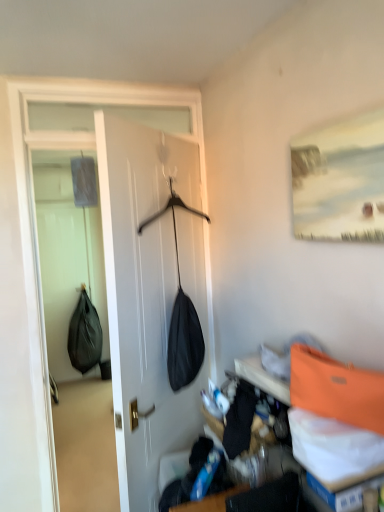
Question: Is black matte shoulder bag at left, arranged as the second shoulder bag when viewed from the right, taller than orange fabric shoulder bag at upper right, marked as the first shoulder bag in a right-to-left arrangement?

Choices:
 (A) yes
 (B) no

Answer: (A)

Question: From the image's perspective, is black matte shoulder bag at left, the 1th shoulder bag positioned from the back, located above orange fabric shoulder bag at upper right, the second shoulder bag when ordered from left to right?

Choices:
 (A) yes
 (B) no

Answer: (B)

Question: Is black matte shoulder bag at left, acting as the 1th shoulder bag starting from the bottom, not within orange fabric shoulder bag at upper right, placed as the first shoulder bag when sorted from front to back?

Choices:
 (A) yes
 (B) no

Answer: (A)

Question: Can you confirm if black matte shoulder bag at left, which ranks as the 1th shoulder bag in left-to-right order, is shorter than orange fabric shoulder bag at upper right, marked as the first shoulder bag in a right-to-left arrangement?

Choices:
 (A) no
 (B) yes

Answer: (A)

Question: Is black matte shoulder bag at left, acting as the 1th shoulder bag starting from the bottom, wider than orange fabric shoulder bag at upper right, the 1th shoulder bag from the top?

Choices:
 (A) no
 (B) yes

Answer: (B)

Question: Considering the relative sizes of black matte shoulder bag at left, the 1th shoulder bag positioned from the back, and orange fabric shoulder bag at upper right, marked as the first shoulder bag in a right-to-left arrangement, in the image provided, is black matte shoulder bag at left, the 1th shoulder bag positioned from the back, smaller than orange fabric shoulder bag at upper right, marked as the first shoulder bag in a right-to-left arrangement,?

Choices:
 (A) no
 (B) yes

Answer: (A)

Question: Considering the relative sizes of black matte shoulder bag at left, which is the second shoulder bag from top to bottom, and matte white painting at upper right in the image provided, is black matte shoulder bag at left, which is the second shoulder bag from top to bottom, thinner than matte white painting at upper right?

Choices:
 (A) no
 (B) yes

Answer: (A)

Question: Does black matte shoulder bag at left, the 1th shoulder bag positioned from the back, have a smaller size compared to matte white painting at upper right?

Choices:
 (A) no
 (B) yes

Answer: (A)

Question: From the image's perspective, is black matte shoulder bag at left, the 1th shoulder bag positioned from the back, beneath matte white painting at upper right?

Choices:
 (A) no
 (B) yes

Answer: (B)

Question: Considering the relative positions of black matte shoulder bag at left, acting as the 1th shoulder bag starting from the bottom, and matte white painting at upper right in the image provided, is black matte shoulder bag at left, acting as the 1th shoulder bag starting from the bottom, to the right of matte white painting at upper right from the viewer's perspective?

Choices:
 (A) no
 (B) yes

Answer: (A)

Question: From a real-world perspective, does black matte shoulder bag at left, which ranks as the 1th shoulder bag in left-to-right order, stand above matte white painting at upper right?

Choices:
 (A) no
 (B) yes

Answer: (A)

Question: Considering the relative positions of orange fabric shoulder bag at upper right, the 1th shoulder bag from the top, and black matte shoulder bag at left, the second shoulder bag when ordered from front to back, in the image provided, is orange fabric shoulder bag at upper right, the 1th shoulder bag from the top, to the right of black matte shoulder bag at left, the second shoulder bag when ordered from front to back, from the viewer's perspective?

Choices:
 (A) yes
 (B) no

Answer: (A)